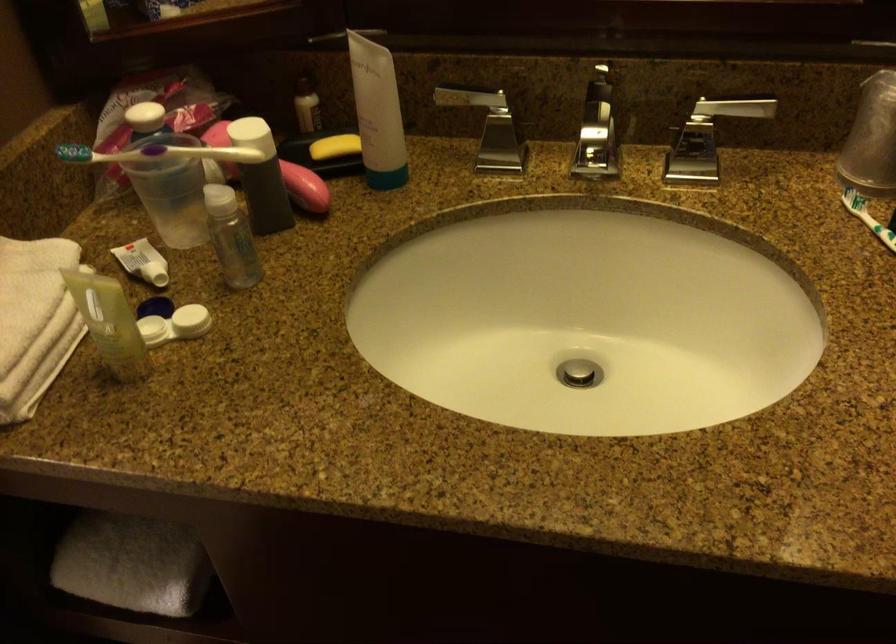
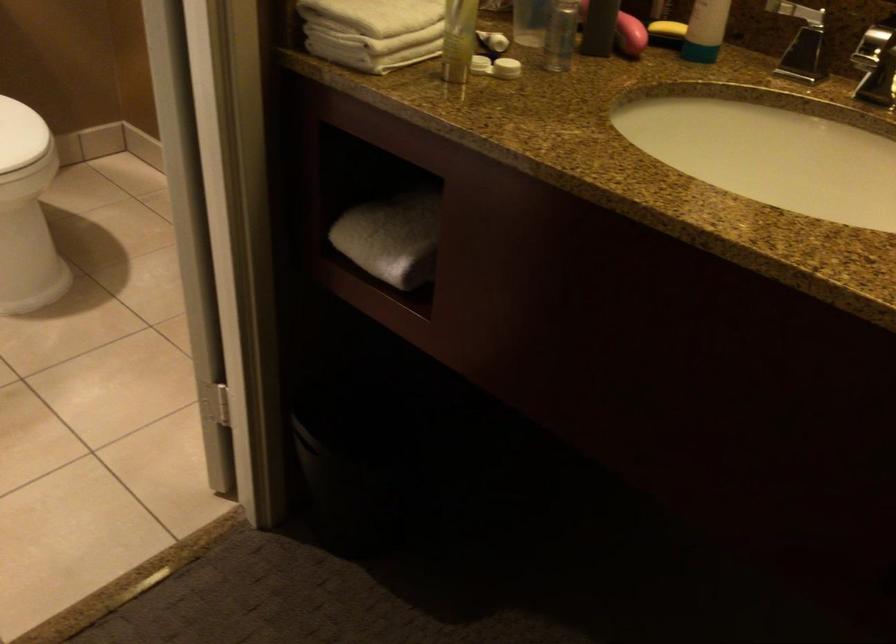
Locate, in the second image, the point that corresponds to the point at 142,560 in the first image.

(392, 238)